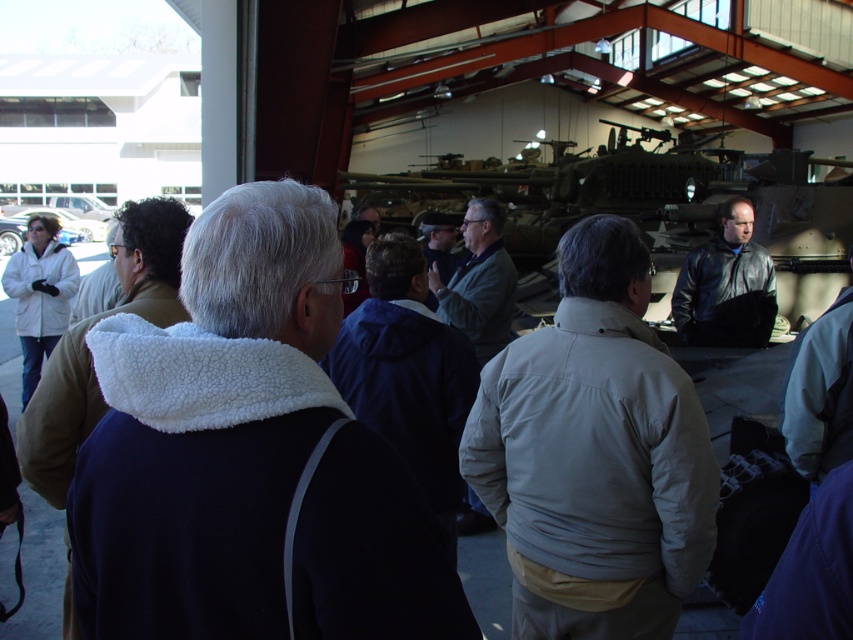
You are a tour guide in the museum. You notice a visitor is looking up at the camouflage paint tank at center. Where should they look to see the light gray jacket at center?

The light gray jacket at center is located below the camouflage paint tank at center, so the visitor should look downward from the camouflage paint tank at center to see the light gray jacket at center.

You are a photographer trying to capture both the camouflage paint tank at center and the white fleece jacket at left in the same frame. Based on their sizes, which object should you focus on first to ensure both fit in the photo?

The camouflage paint tank at center is bigger than the white fleece jacket at left, so you should focus on the camouflage paint tank at center first to ensure both fit in the photo.

You are a tour guide in the museum. You notice a visitor pointing at the camouflage paint tank at center and asking about its position relative to the white fleece jacket at left. How would you describe its location?

The camouflage paint tank at center is located above the white fleece jacket at left, meaning it is positioned higher up in the display compared to the jacket.